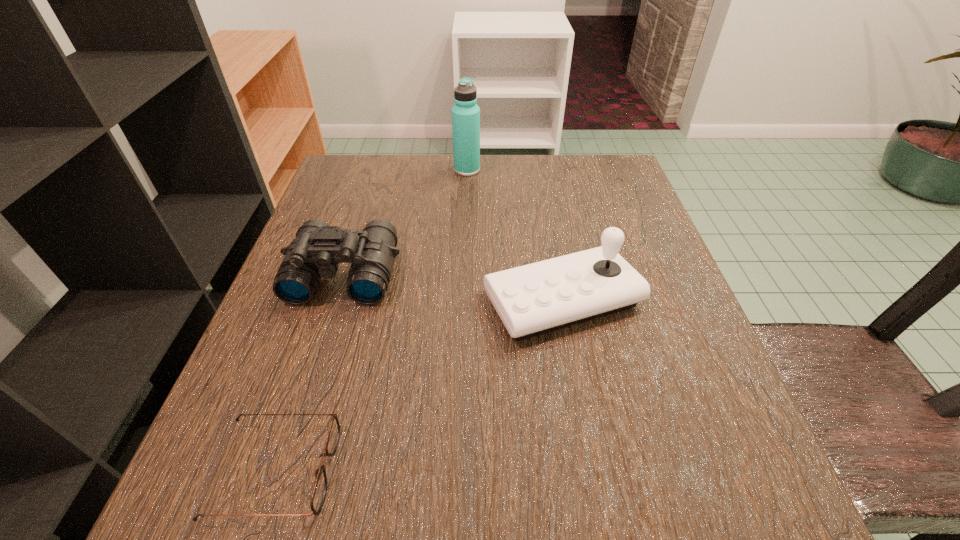
Identify the location of the tallest object. This screenshot has height=540, width=960. (465, 113).

I want to click on the second object from right to left, so click(465, 113).

I want to click on the rightmost object, so click(x=537, y=298).

Identify the location of binoculars. The image size is (960, 540). (318, 248).

At what (x,y) coordinates should I click in order to perform the action: click on sunglasses. Please return your answer as a coordinate pair (x, y). The height and width of the screenshot is (540, 960). Looking at the image, I should click on (319, 492).

At what (x,y) coordinates should I click in order to perform the action: click on the shortest object. Please return your answer as a coordinate pair (x, y). This screenshot has height=540, width=960. Looking at the image, I should click on (319, 492).

Find the location of `vacant space located 0.110m on the front of the second object from right to left`. vacant space located 0.110m on the front of the second object from right to left is located at coordinates click(x=466, y=202).

Where is `free spot located 0.390m on the back of the rightmost object`? This screenshot has height=540, width=960. free spot located 0.390m on the back of the rightmost object is located at coordinates (537, 160).

The width and height of the screenshot is (960, 540). What are the coordinates of `vacant space located through the lenses of the binoculars` in the screenshot? It's located at (308, 386).

Locate an element on the screen. free space located on the front-facing side of the sunglasses is located at coordinates (557, 471).